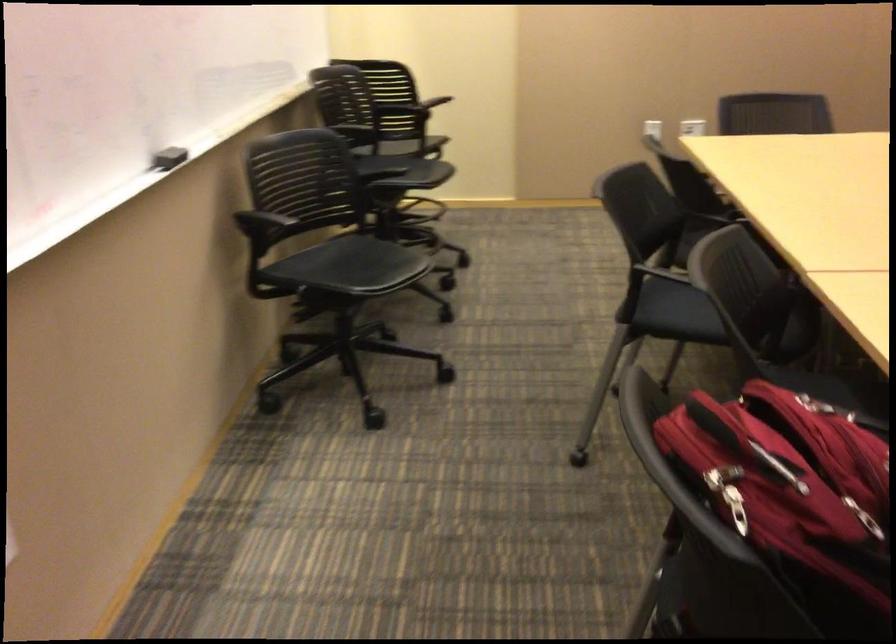
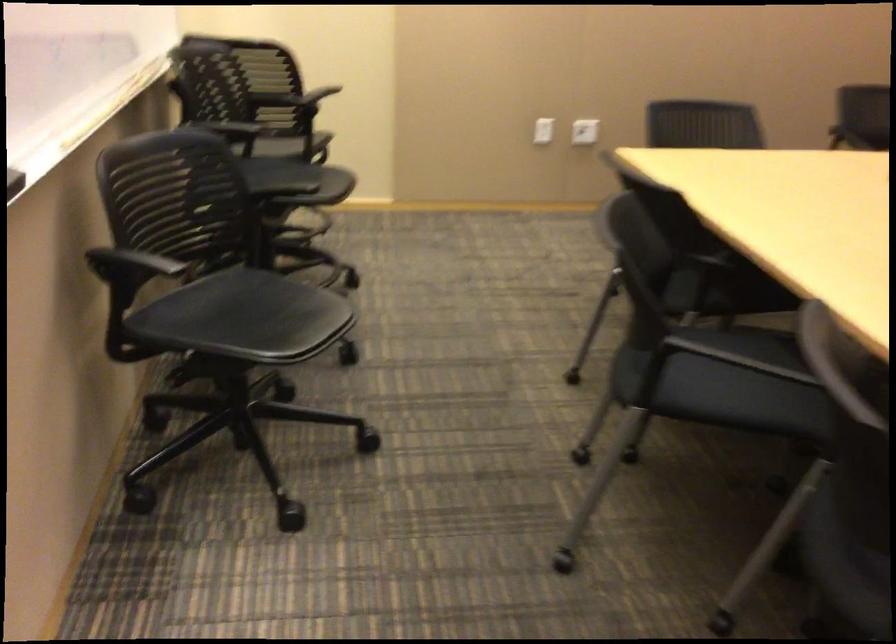
Question: The first image is from the beginning of the video and the second image is from the end. How did the camera likely rotate when shooting the video?

Choices:
 (A) Left
 (B) Right
 (C) Up
 (D) Down

Answer: (B)